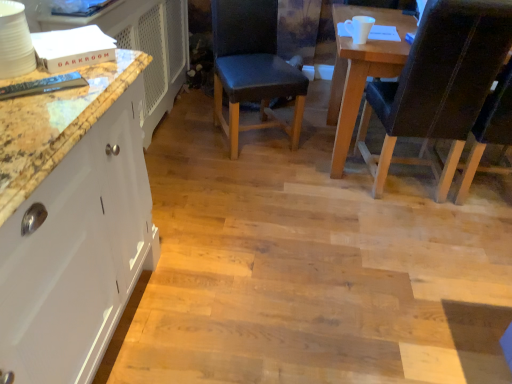
You are a GUI agent. You are given a task and a screenshot of the screen. Output one action in this format:
    pyautogui.click(x=<x>, y=<y>)
    Task: Click on the vacant space to the left of dark blue leather chair at center, acting as the first chair starting from the left
    This screenshot has width=512, height=384.
    Given the screenshot: What is the action you would take?
    pyautogui.click(x=188, y=132)